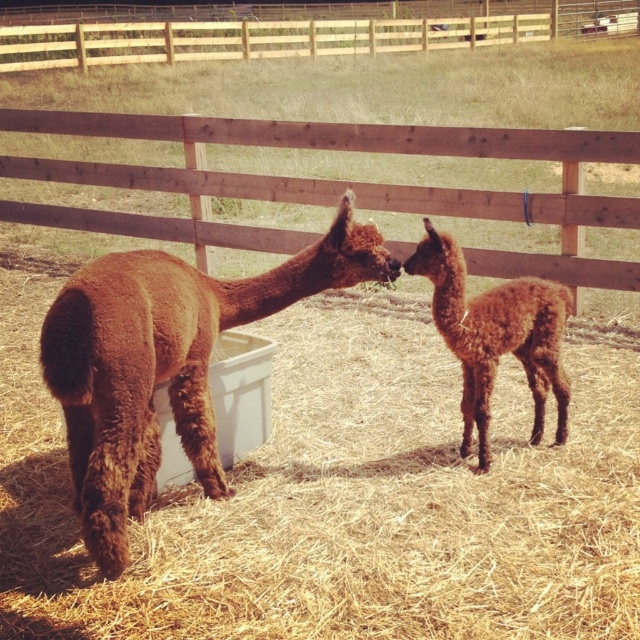
Between brown woolen alpaca at center and brown fuzzy alpaca at center, which one appears on the left side from the viewer's perspective?

brown woolen alpaca at center

Can you confirm if brown woolen alpaca at center is bigger than brown fuzzy alpaca at center?

Correct, brown woolen alpaca at center is larger in size than brown fuzzy alpaca at center.

Locate an element on the screen. This screenshot has width=640, height=640. brown woolen alpaca at center is located at coordinates (164, 362).